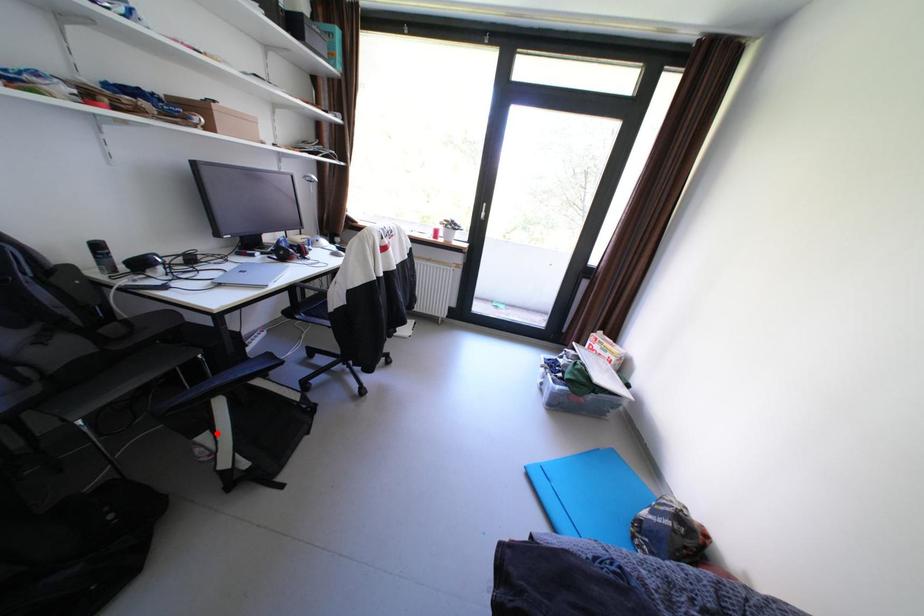
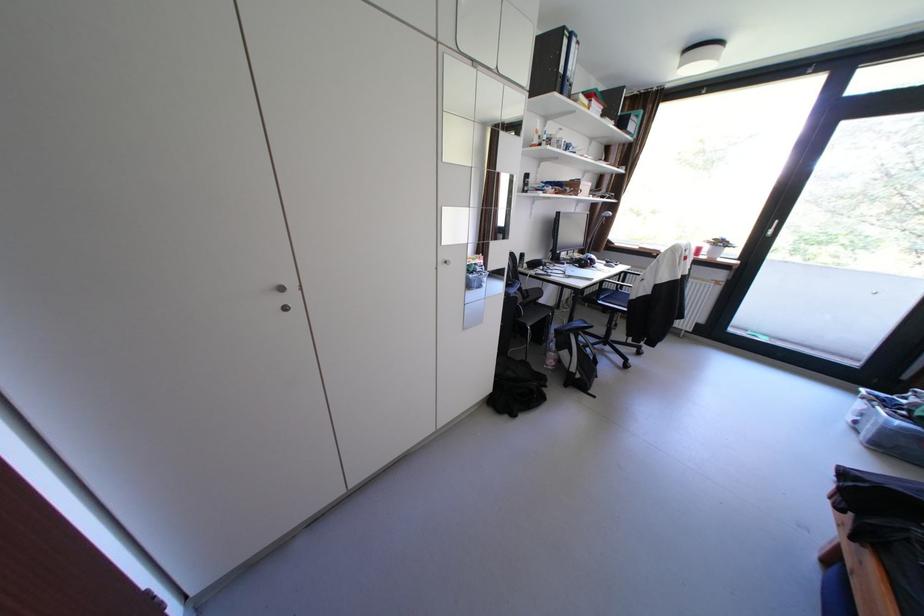
Find the pixel in the second image that matches the highlighted location in the first image.

(578, 351)